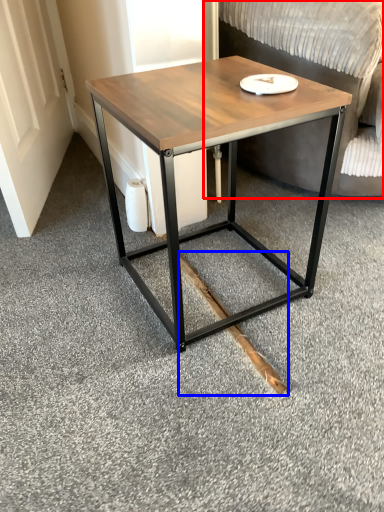
Question: Which of the following is the farthest to the observer, swivel chair (highlighted by a red box) or wood (highlighted by a blue box)?

Choices:
 (A) swivel chair
 (B) wood

Answer: (B)